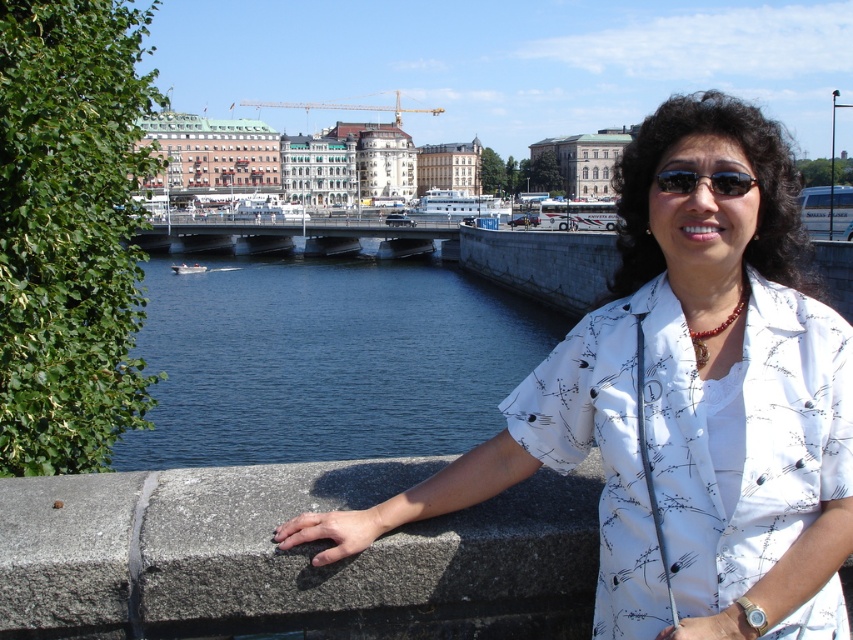
What do you see at coordinates (302, 236) in the screenshot? I see `concrete bridge at center` at bounding box center [302, 236].

Is concrete bridge at center smaller than black reflective sunglasses at center?

Actually, concrete bridge at center might be larger than black reflective sunglasses at center.

Does point (225, 227) lie behind point (683, 179)?

That is True.

Locate an element on the screen. concrete bridge at center is located at coordinates (302, 236).

Can you confirm if blue water at center is positioned above black reflective sunglasses at center?

No, blue water at center is not above black reflective sunglasses at center.

Does blue water at center have a smaller size compared to black reflective sunglasses at center?

No.

Describe the element at coordinates (328, 360) in the screenshot. I see `blue water at center` at that location.

At what (x,y) coordinates should I click in order to perform the action: click on blue water at center. Please return your answer as a coordinate pair (x, y). Looking at the image, I should click on (328, 360).

Who is positioned more to the left, white printed blouse at center or blue water at center?

blue water at center

This screenshot has width=853, height=640. Describe the element at coordinates (683, 403) in the screenshot. I see `white printed blouse at center` at that location.

Describe the element at coordinates (683, 403) in the screenshot. I see `white printed blouse at center` at that location.

Locate an element on the screen. white printed blouse at center is located at coordinates (683, 403).